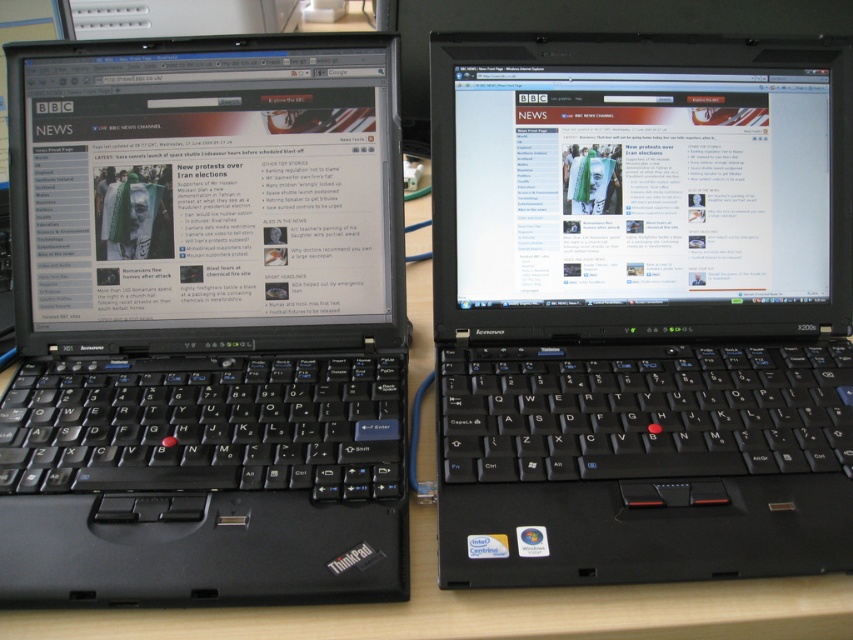
Question: Can you confirm if black plastic laptop at center is positioned to the right of wooden table at center?

Choices:
 (A) no
 (B) yes

Answer: (B)

Question: Which of the following is the farthest from the observer?

Choices:
 (A) black plastic laptop at left
 (B) wooden table at center
 (C) green fabric couple at center

Answer: (C)

Question: In this image, where is black plastic laptop at left located relative to green fabric couple at center?

Choices:
 (A) left
 (B) right

Answer: (B)

Question: Considering the real-world distances, which object is closest to the black plastic laptop at center?

Choices:
 (A) black plastic laptop at left
 (B) wooden table at center
 (C) green fabric couple at center

Answer: (B)

Question: Considering the real-world distances, which object is farthest from the black plastic laptop at left?

Choices:
 (A) wooden table at center
 (B) green fabric couple at center

Answer: (A)

Question: Is wooden table at center to the right of green fabric couple at center from the viewer's perspective?

Choices:
 (A) no
 (B) yes

Answer: (B)